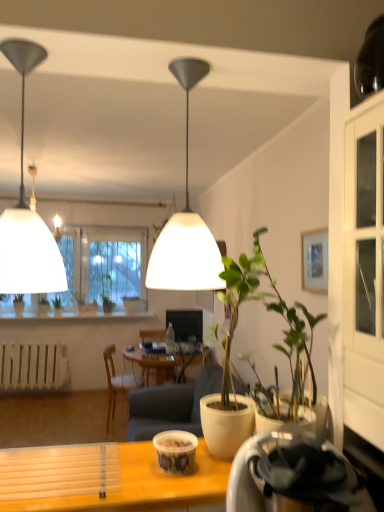
Question: Which direction should I rotate to look at white matte lampshade at center, marked as the 1th lamp in a right-to-left arrangement, — up or down?

Choices:
 (A) down
 (B) up

Answer: (B)

Question: Is green matte plant at center, marked as the first houseplant in a right-to-left arrangement, wider than green matte plant at center, the 2th houseplant from the left?

Choices:
 (A) yes
 (B) no

Answer: (A)

Question: Does green matte plant at center, which is counted as the 1th houseplant, starting from the front, have a smaller size compared to green matte plant at center, the 2th houseplant viewed from the back?

Choices:
 (A) yes
 (B) no

Answer: (B)

Question: From the image's perspective, is green matte plant at center, which is the fourth houseplant in left-to-right order, on green matte plant at center, the 2th houseplant from the left?

Choices:
 (A) yes
 (B) no

Answer: (A)

Question: Does green matte plant at center, marked as the first houseplant in a right-to-left arrangement, have a lesser width compared to green matte plant at center, the 2th houseplant viewed from the back?

Choices:
 (A) no
 (B) yes

Answer: (A)

Question: Is green matte plant at center, which is the fourth houseplant in left-to-right order, not close to green matte plant at center, which ranks as the third houseplant in right-to-left order?

Choices:
 (A) yes
 (B) no

Answer: (A)

Question: Considering the relative positions of green matte plant at center, which is counted as the 1th houseplant, starting from the front, and green matte plant at center, the 2th houseplant viewed from the back, in the image provided, is green matte plant at center, which is counted as the 1th houseplant, starting from the front, to the left of green matte plant at center, the 2th houseplant viewed from the back, from the viewer's perspective?

Choices:
 (A) yes
 (B) no

Answer: (B)

Question: Is wooden chair at center not near wooden desk at lower center?

Choices:
 (A) yes
 (B) no

Answer: (A)

Question: Is wooden chair at center facing away from wooden desk at lower center?

Choices:
 (A) no
 (B) yes

Answer: (A)

Question: Is wooden chair at center thinner than wooden desk at lower center?

Choices:
 (A) no
 (B) yes

Answer: (A)

Question: Can you confirm if wooden chair at center is shorter than wooden desk at lower center?

Choices:
 (A) no
 (B) yes

Answer: (A)

Question: Is the position of wooden chair at center less distant than that of wooden desk at lower center?

Choices:
 (A) yes
 (B) no

Answer: (B)

Question: Is wooden desk at lower center completely or partially inside wooden chair at center?

Choices:
 (A) yes
 (B) no

Answer: (B)

Question: Does green matte plant at center, the 2th houseplant viewed from the back, have a larger size compared to white matte radiator at lower left?

Choices:
 (A) no
 (B) yes

Answer: (A)